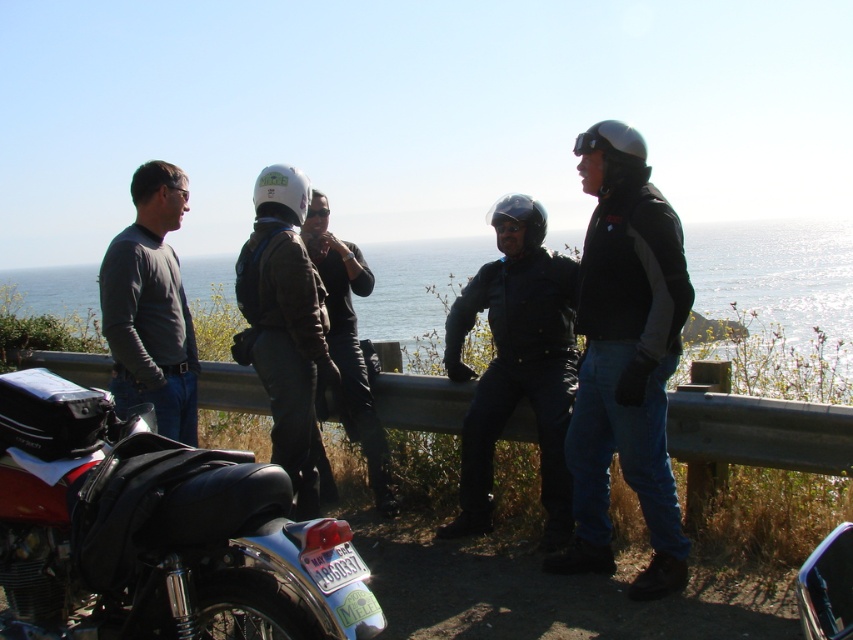
Question: Which of the following is the closest to the observer?

Choices:
 (A) (817, 308)
 (B) (157, 388)
 (C) (282, 324)

Answer: (B)

Question: Among these points, which one is nearest to the camera?

Choices:
 (A) pos(621,257)
 (B) pos(320,403)
 (C) pos(311,438)
 (D) pos(9,582)

Answer: (D)

Question: Which point is farther to the camera?

Choices:
 (A) (373, 333)
 (B) (323, 300)
 (C) (169, 337)
 (D) (262, 484)

Answer: (A)

Question: Does clear blue water at upper center appear under black leather jacket at center?

Choices:
 (A) no
 (B) yes

Answer: (A)

Question: Is black matte jacket at center wider than clear blue water at upper center?

Choices:
 (A) yes
 (B) no

Answer: (B)

Question: Can you confirm if clear blue water at upper center is wider than matte black helmet at center?

Choices:
 (A) no
 (B) yes

Answer: (B)